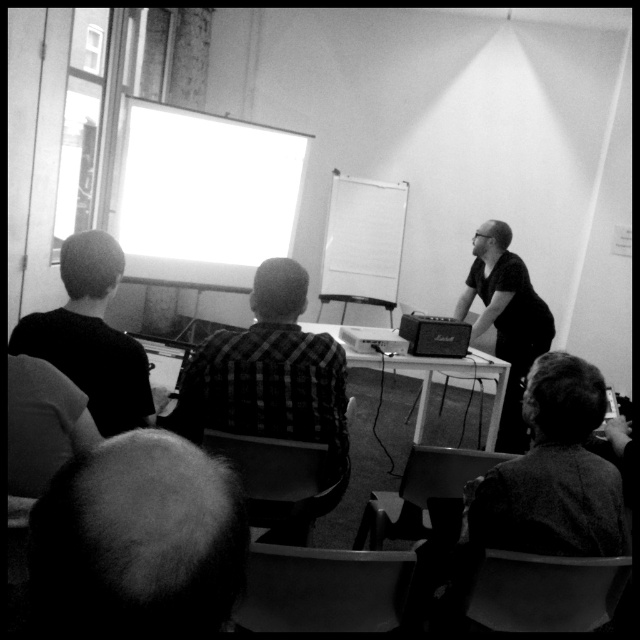
You are a photographer who wants to capture a closeup shot of both the smooth bald head at lower left and the checkered fabric shirt at center. Which object should you zoom in on first to ensure it fits within your camera frame?

The smooth bald head at lower left is thinner than the checkered fabric shirt at center, so you should zoom in on the checkered fabric shirt at center first to ensure it fits within your camera frame.

You are a photographer standing at the back of the room. You want to take a photo of the speaker at point (170, 477) and another object at point (403, 196). Which point do you need to focus on first to ensure both are in focus?

Point (170, 477) is closer to the camera than point (403, 196). To ensure both are in focus, you should focus on the closer point first.